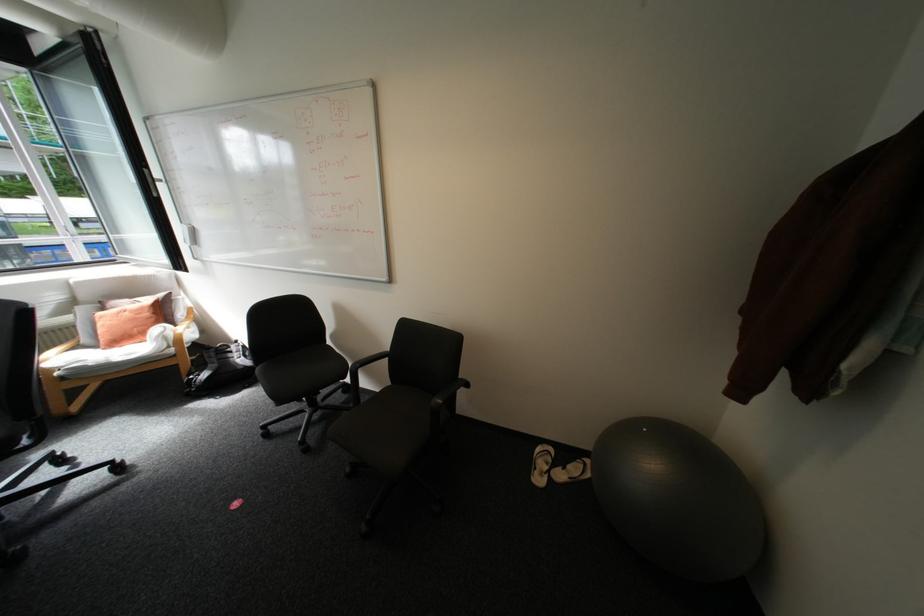
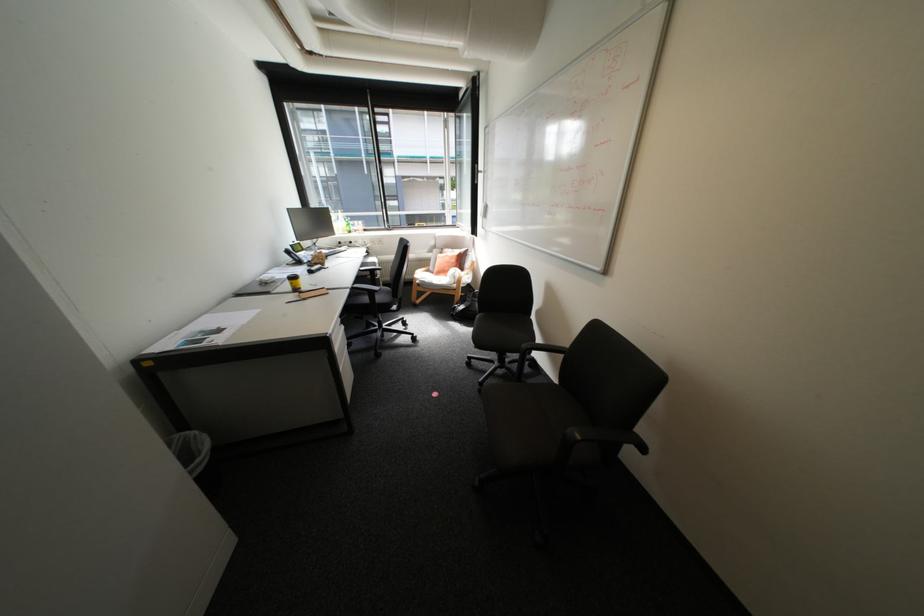
In the second image, find the point that corresponds to pixel 137 301 in the first image.

(459, 249)